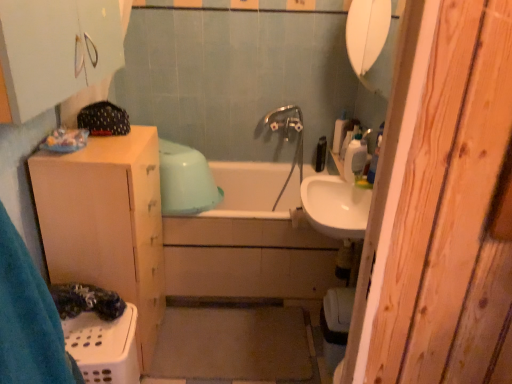
Question: Is white plastic soap dispenser at upper right to the left of black plastic bottle at upper center, which is the 1th toiletry from back to front, from the viewer's perspective?

Choices:
 (A) no
 (B) yes

Answer: (A)

Question: Is white plastic soap dispenser at upper right thinner than black plastic bottle at upper center, which is the 1th toiletry from back to front?

Choices:
 (A) yes
 (B) no

Answer: (A)

Question: Does white plastic soap dispenser at upper right have a lesser height compared to black plastic bottle at upper center, the third toiletry viewed from the front?

Choices:
 (A) no
 (B) yes

Answer: (A)

Question: From a real-world perspective, is white plastic soap dispenser at upper right located higher than black plastic bottle at upper center, which is the 1th toiletry from back to front?

Choices:
 (A) yes
 (B) no

Answer: (A)

Question: From the image's perspective, would you say white plastic soap dispenser at upper right is positioned over black plastic bottle at upper center, which is the 1th toiletry from back to front?

Choices:
 (A) yes
 (B) no

Answer: (B)

Question: Is white plastic soap dispenser at upper right oriented away from black plastic bottle at upper center, the third toiletry viewed from the front?

Choices:
 (A) yes
 (B) no

Answer: (B)

Question: Is black plastic bottle at upper center, which is the 1th toiletry from back to front, to the left of chrome metallic faucet at center from the viewer's perspective?

Choices:
 (A) yes
 (B) no

Answer: (B)

Question: Can you confirm if black plastic bottle at upper center, the third toiletry viewed from the front, is taller than chrome metallic faucet at center?

Choices:
 (A) yes
 (B) no

Answer: (B)

Question: Could you tell me if black plastic bottle at upper center, which is the 1th toiletry from back to front, is facing chrome metallic faucet at center?

Choices:
 (A) yes
 (B) no

Answer: (A)

Question: Would you say black plastic bottle at upper center, which is the 1th toiletry from back to front, contains chrome metallic faucet at center?

Choices:
 (A) no
 (B) yes

Answer: (A)

Question: Is black plastic bottle at upper center, the third toiletry viewed from the front, further to camera compared to chrome metallic faucet at center?

Choices:
 (A) yes
 (B) no

Answer: (A)

Question: From a real-world perspective, is black plastic bottle at upper center, which is the 1th toiletry from back to front, located higher than chrome metallic faucet at center?

Choices:
 (A) yes
 (B) no

Answer: (A)

Question: Is black plastic bottle at upper center, which is the 1th toiletry from back to front, positioned far away from white glossy sink at center?

Choices:
 (A) no
 (B) yes

Answer: (A)